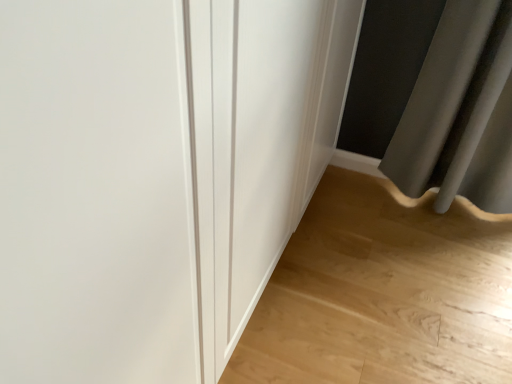
Question: Can you confirm if white smooth door at center is taller than light wood floor at lower right?

Choices:
 (A) no
 (B) yes

Answer: (B)

Question: Does white smooth door at center have a lesser height compared to light wood floor at lower right?

Choices:
 (A) no
 (B) yes

Answer: (A)

Question: Does white smooth door at center lie in front of light wood floor at lower right?

Choices:
 (A) yes
 (B) no

Answer: (A)

Question: Is white smooth door at center to the right of light wood floor at lower right from the viewer's perspective?

Choices:
 (A) no
 (B) yes

Answer: (A)

Question: From a real-world perspective, is white smooth door at center beneath light wood floor at lower right?

Choices:
 (A) yes
 (B) no

Answer: (B)

Question: Is the depth of white smooth door at center greater than that of light wood floor at lower right?

Choices:
 (A) yes
 (B) no

Answer: (B)

Question: Does light wood floor at lower right appear on the left side of white smooth door at center?

Choices:
 (A) no
 (B) yes

Answer: (A)

Question: Is light wood floor at lower right taller than white smooth door at center?

Choices:
 (A) no
 (B) yes

Answer: (A)

Question: Is light wood floor at lower right far away from white smooth door at center?

Choices:
 (A) yes
 (B) no

Answer: (B)

Question: Would you say light wood floor at lower right is outside white smooth door at center?

Choices:
 (A) no
 (B) yes

Answer: (B)

Question: Is white smooth door at center at the back of light wood floor at lower right?

Choices:
 (A) yes
 (B) no

Answer: (B)

Question: From a real-world perspective, is light wood floor at lower right on white smooth door at center?

Choices:
 (A) yes
 (B) no

Answer: (B)

Question: Considering the positions of light wood floor at lower right and white smooth door at center in the image, is light wood floor at lower right taller or shorter than white smooth door at center?

Choices:
 (A) tall
 (B) short

Answer: (B)